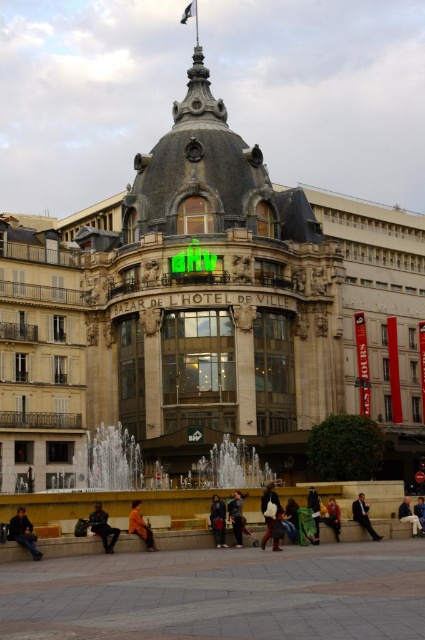
Question: Is the position of dark brown leather jacket at lower left less distant than that of dark blue jeans at lower center?

Choices:
 (A) yes
 (B) no

Answer: (A)

Question: Can you confirm if green fabric jacket at center is positioned to the left of blue denim jeans at lower center?

Choices:
 (A) yes
 (B) no

Answer: (A)

Question: Which point is closer to the camera?

Choices:
 (A) (368, 518)
 (B) (317, 520)
 (C) (110, 550)

Answer: (C)

Question: Estimate the real-world distances between objects in this image. Which object is closer to the green fabric jacket at center?

Choices:
 (A) orange fabric jacket at lower center
 (B) light blue jeans at lower right
 (C) dark brown leather jacket at lower left

Answer: (A)

Question: In this image, where is dark blue jeans at lower center located relative to blue denim jeans at lower center?

Choices:
 (A) left
 (B) right

Answer: (A)

Question: Which is farther from the dark blue jeans at lower left?

Choices:
 (A) orange fabric jacket at lower center
 (B) light blue jeans at lower right

Answer: (B)